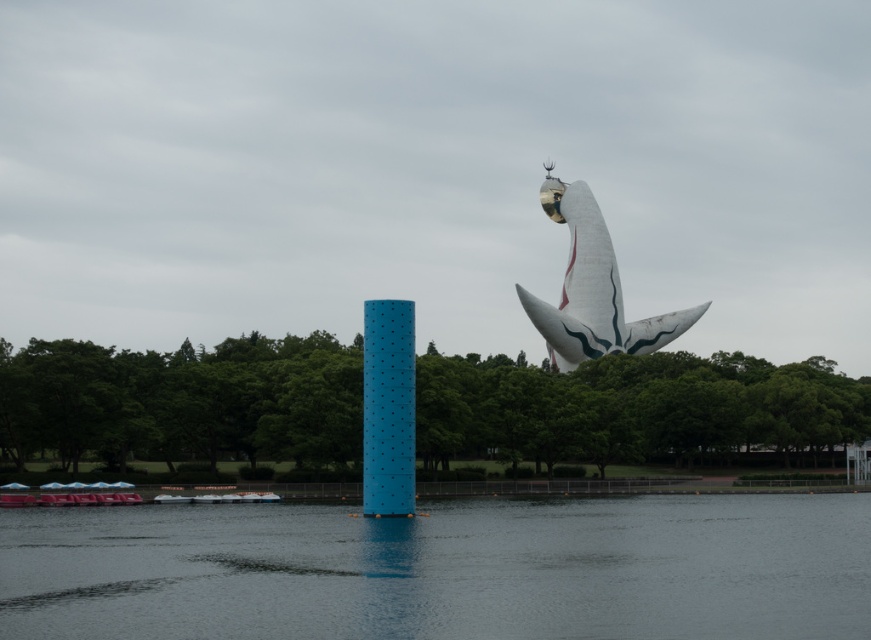
Does white glossy sculpture at upper center come behind white plastic boat at lower left?

Yes, it is.

Does white glossy sculpture at upper center have a greater height compared to white plastic boat at lower left?

Yes.

Describe the element at coordinates (592, 289) in the screenshot. Image resolution: width=871 pixels, height=640 pixels. I see `white glossy sculpture at upper center` at that location.

This screenshot has width=871, height=640. I want to click on white glossy sculpture at upper center, so click(x=592, y=289).

Who is lower down, smooth gray water at lower center or white plastic boat at lower left?

white plastic boat at lower left is below.

Is smooth gray water at lower center wider than white plastic boat at lower left?

Correct, the width of smooth gray water at lower center exceeds that of white plastic boat at lower left.

Between point (163, 598) and point (172, 497), which one is positioned behind?

Point (172, 497)

Find the location of a particular element. smooth gray water at lower center is located at coordinates (443, 570).

Does smooth gray water at lower center have a greater height compared to white glossy sculpture at upper center?

No.

Who is positioned more to the left, smooth gray water at lower center or white glossy sculpture at upper center?

smooth gray water at lower center

Where is `smooth gray water at lower center`? The width and height of the screenshot is (871, 640). smooth gray water at lower center is located at coordinates (443, 570).

Where is `smooth gray water at lower center`? This screenshot has height=640, width=871. smooth gray water at lower center is located at coordinates (443, 570).